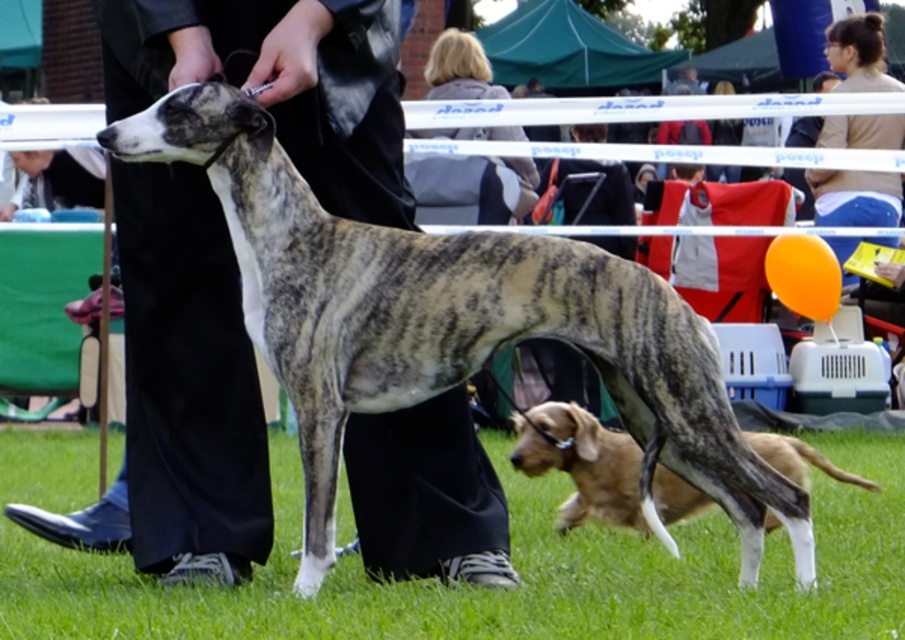
Where is `smooth black pants at center`? smooth black pants at center is located at coordinates (187, 384).

Can you confirm if smooth black pants at center is wider than speckled fur dog at center?

No, smooth black pants at center is not wider than speckled fur dog at center.

Identify the location of smooth black pants at center. The width and height of the screenshot is (905, 640). (187, 384).

Between blonde hair at upper center and brown leather jacket at upper right, which one appears on the left side from the viewer's perspective?

Positioned to the left is blonde hair at upper center.

Is blonde hair at upper center positioned at the back of brown leather jacket at upper right?

No, it is in front of brown leather jacket at upper right.

Where is `blonde hair at upper center`? Image resolution: width=905 pixels, height=640 pixels. blonde hair at upper center is located at coordinates (472, 186).

Where is `blonde hair at upper center`? Image resolution: width=905 pixels, height=640 pixels. blonde hair at upper center is located at coordinates (472, 186).

How far apart are smooth black pants at center and brown fur dog at lower right?

smooth black pants at center and brown fur dog at lower right are 1.89 meters apart.

Between point (174, 483) and point (526, 468), which one is positioned behind?

Positioned behind is point (526, 468).

This screenshot has height=640, width=905. Identify the location of smooth black pants at center. point(187,384).

Image resolution: width=905 pixels, height=640 pixels. What are the coordinates of `smooth black pants at center` in the screenshot? It's located at (187, 384).